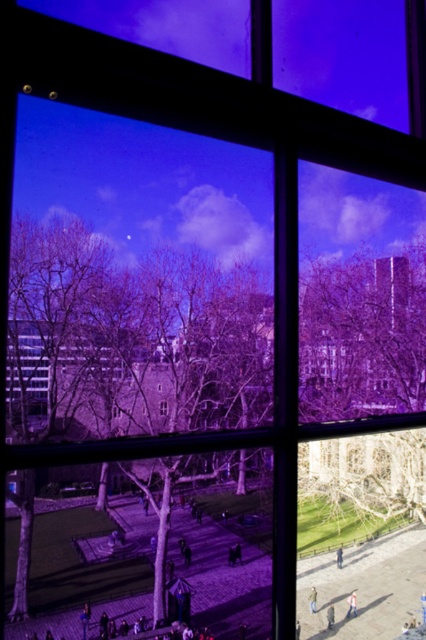
Question: Does khaki fabric jacket at lower right appear under light brown leather jacket at lower center?

Choices:
 (A) no
 (B) yes

Answer: (B)

Question: Is white cotton shirt at lower right closer to camera compared to khaki fabric jacket at lower right?

Choices:
 (A) yes
 (B) no

Answer: (A)

Question: Which object is farther from the camera taking this photo?

Choices:
 (A) light brown leather jacket at center
 (B) light brown leather jacket at lower center
 (C) white cotton shirt at lower right
 (D) purple fabric at center

Answer: (B)

Question: Among these points, which one is nearest to the camera?

Choices:
 (A) (340, 554)
 (B) (161, 410)

Answer: (A)

Question: Which of the following is the farthest from the observer?

Choices:
 (A) light brown leather jacket at lower center
 (B) light brown leather jacket at center

Answer: (A)

Question: Does light brown leather jacket at center come behind transparent glass window at center?

Choices:
 (A) no
 (B) yes

Answer: (A)